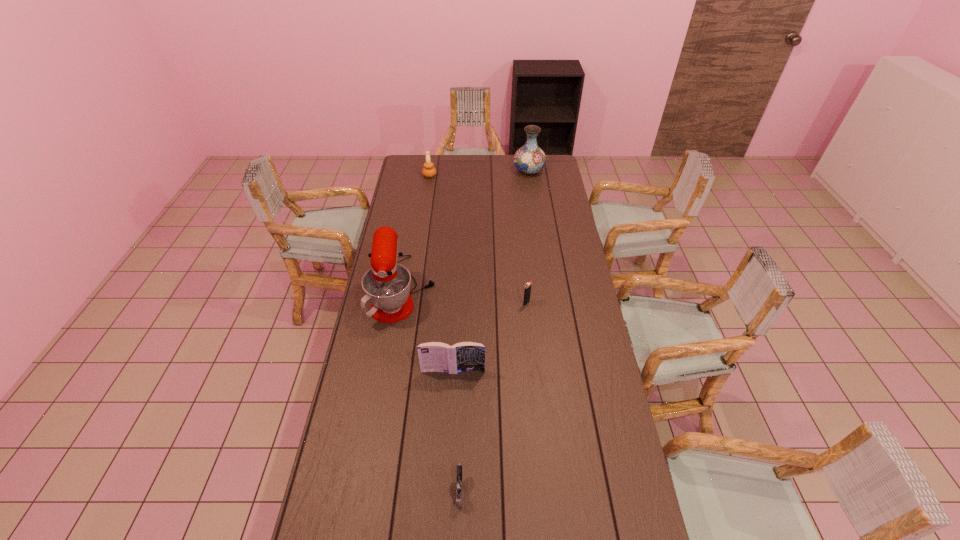
The image size is (960, 540). Find the location of `vacant point at the left edge`. vacant point at the left edge is located at coordinates (379, 448).

This screenshot has height=540, width=960. What are the coordinates of `free space at the right edge of the desktop` in the screenshot? It's located at point(615,509).

Where is `free space at the far left corner of the desktop`? The image size is (960, 540). free space at the far left corner of the desktop is located at coordinates (417, 157).

This screenshot has width=960, height=540. Find the location of `vacant point at the far right corner`. vacant point at the far right corner is located at coordinates (552, 160).

Locate an element on the screen. free space between the vase and the mixer is located at coordinates (467, 230).

Identify the location of vacant point located between the right igniter and the fifth farthest object. This screenshot has height=540, width=960. (490, 337).

The image size is (960, 540). I want to click on vacant space that is in between the right igniter and the mixer, so click(466, 296).

The height and width of the screenshot is (540, 960). What are the coordinates of `vacant area that lies between the left igniter and the farther igniter` in the screenshot? It's located at (493, 396).

The height and width of the screenshot is (540, 960). Find the location of `free space between the left igniter and the second nearest object`. free space between the left igniter and the second nearest object is located at coordinates (457, 430).

The height and width of the screenshot is (540, 960). In order to click on blank region between the book and the farther igniter in this screenshot , I will do `click(490, 337)`.